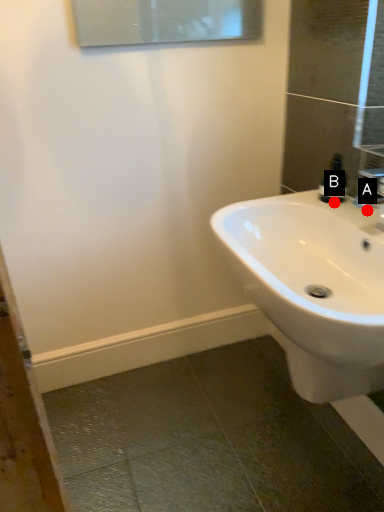
Question: Two points are circled on the image, labeled by A and B beside each circle. Which point is farther from the camera taking this photo?

Choices:
 (A) A is further
 (B) B is further

Answer: (B)